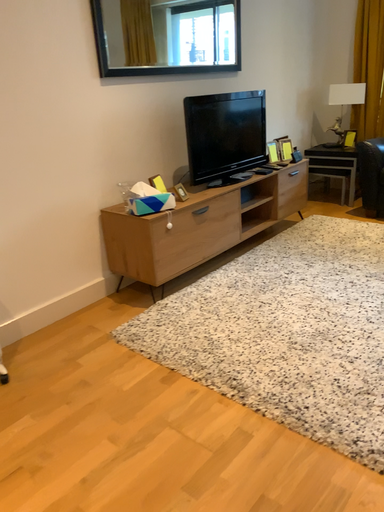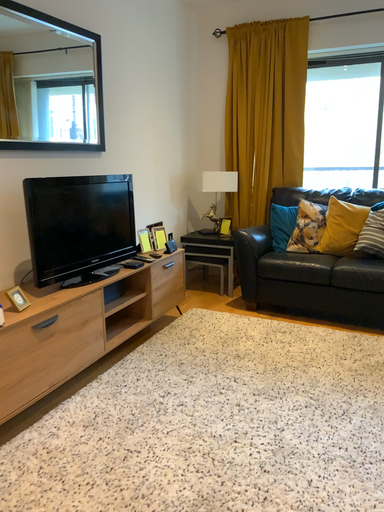
Question: How did the camera likely rotate when shooting the video?

Choices:
 (A) rotated upward
 (B) rotated downward

Answer: (A)